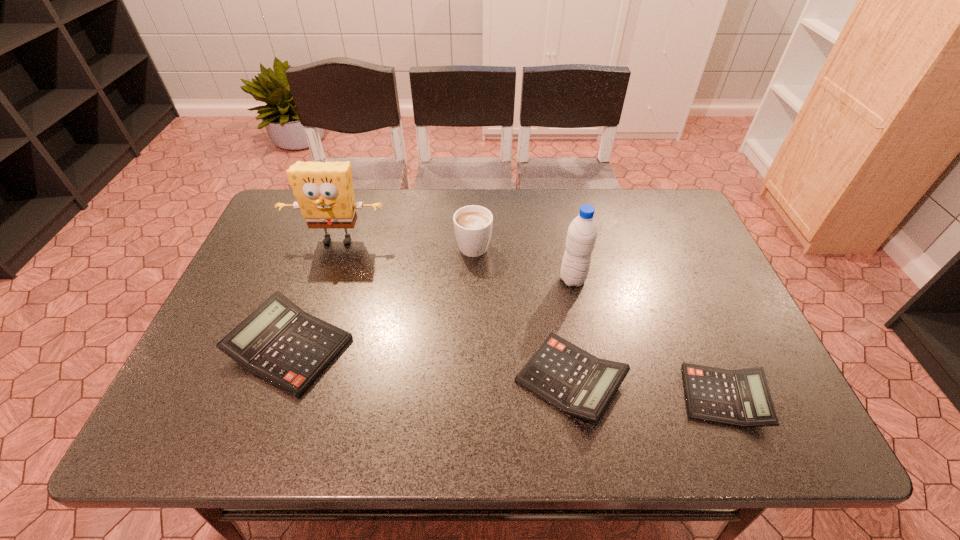
Where is `free location located 0.130m on the right of the second shortest object`? The image size is (960, 540). free location located 0.130m on the right of the second shortest object is located at coordinates (685, 380).

Where is `vacant area situated 0.080m on the back of the rightmost object`? The height and width of the screenshot is (540, 960). vacant area situated 0.080m on the back of the rightmost object is located at coordinates (699, 337).

Find the location of a particular element. This screenshot has height=540, width=960. vacant area situated on the face of the sponge is located at coordinates (328, 268).

Image resolution: width=960 pixels, height=540 pixels. In order to click on free region located with the handle on the side of the cappuccino in this screenshot , I will do `click(474, 212)`.

The image size is (960, 540). Identify the location of vacant space situated on the right of the fourth nearest object. (619, 280).

Identify the location of sponge that is positioned at the far edge. This screenshot has width=960, height=540. point(324,191).

Locate an element on the screen. The image size is (960, 540). cappuccino present at the far edge is located at coordinates (473, 224).

The image size is (960, 540). In order to click on calculator present at the left edge in this screenshot , I will do `click(280, 343)`.

I want to click on sponge at the left edge, so click(x=324, y=191).

Locate an element on the screen. The image size is (960, 540). object that is at the right edge is located at coordinates (741, 398).